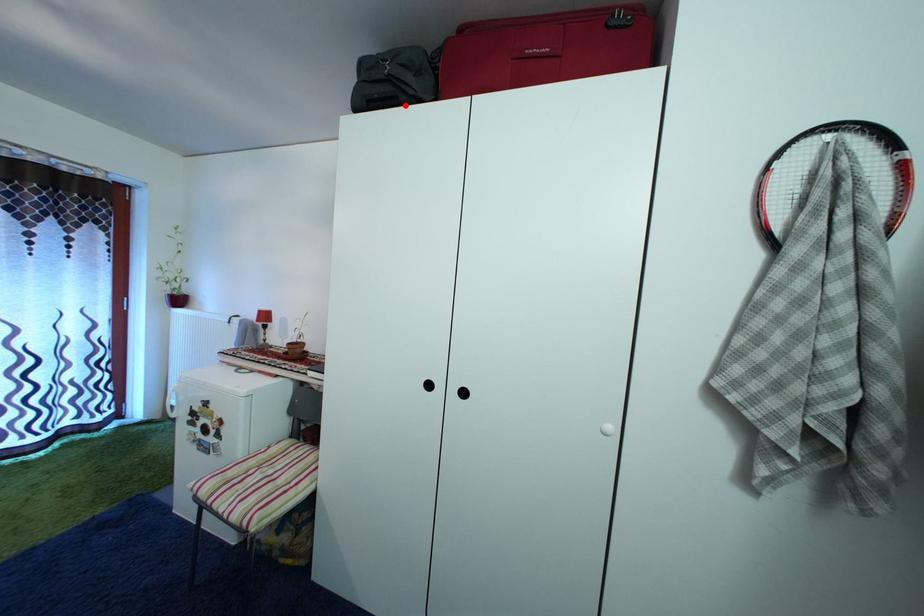
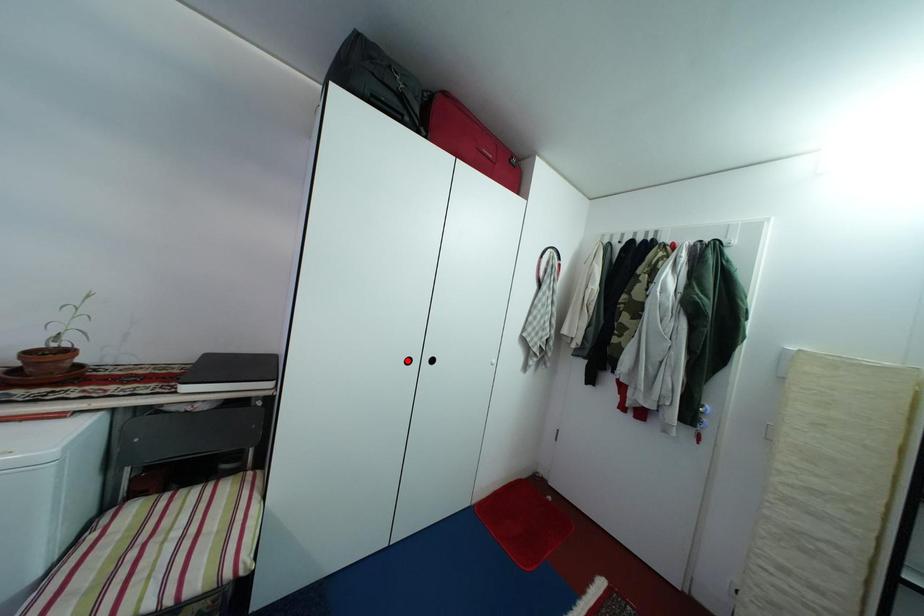
Consider the image. I am providing you with two images of the same scene from different viewpoints. A red point is marked on the first image and another point is marked on the second image. Is the red point in image1 aligned with the point shown in image2?

No